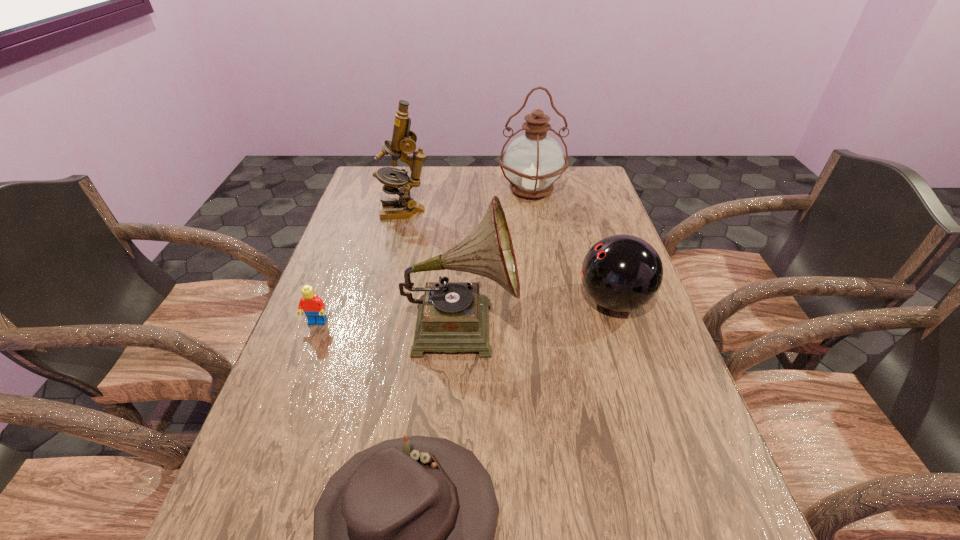
Find the location of a particular element. This screenshot has width=960, height=540. vacant area that lies between the oil lamp and the leftmost object is located at coordinates pos(424,256).

Identify the location of free spot between the microscope and the oil lamp. Image resolution: width=960 pixels, height=540 pixels. (468, 200).

Where is `unoccupied position between the microscope and the Lego`? This screenshot has width=960, height=540. unoccupied position between the microscope and the Lego is located at coordinates (361, 267).

You are a GUI agent. You are given a task and a screenshot of the screen. Output one action in this format:
    pyautogui.click(x=<x>, y=<y>)
    Task: Click on the free space between the Lego and the record player
    The width and height of the screenshot is (960, 540).
    Given the screenshot: What is the action you would take?
    pyautogui.click(x=389, y=324)

The image size is (960, 540). Find the location of `vacant area that lies between the bowling ball and the record player`. vacant area that lies between the bowling ball and the record player is located at coordinates (538, 313).

You are a GUI agent. You are given a task and a screenshot of the screen. Output one action in this format:
    pyautogui.click(x=<x>, y=<y>)
    Task: Click on the unoccupied position between the leftmost object and the microscope
    This screenshot has height=540, width=960.
    Given the screenshot: What is the action you would take?
    pyautogui.click(x=361, y=267)

Locate an element on the screen. vacant point located between the oil lamp and the third shortest object is located at coordinates (572, 246).

You are a GUI agent. You are given a task and a screenshot of the screen. Output one action in this format:
    pyautogui.click(x=<x>, y=<y>)
    Task: Click on the object that is the third closest to the Lego
    
    Given the screenshot: What is the action you would take?
    pyautogui.click(x=404, y=140)

Identify the location of object that is the second nearest to the leftmost object. (403, 532).